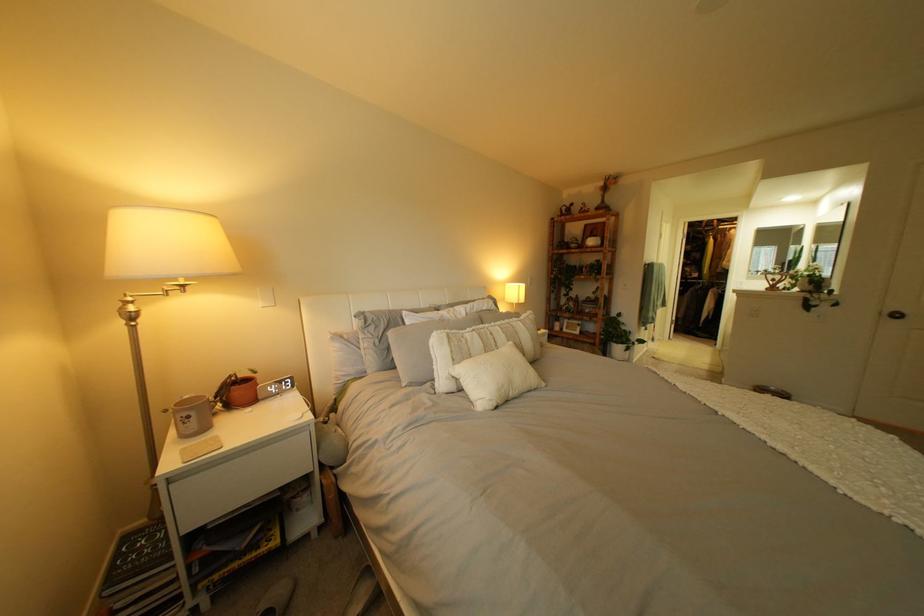
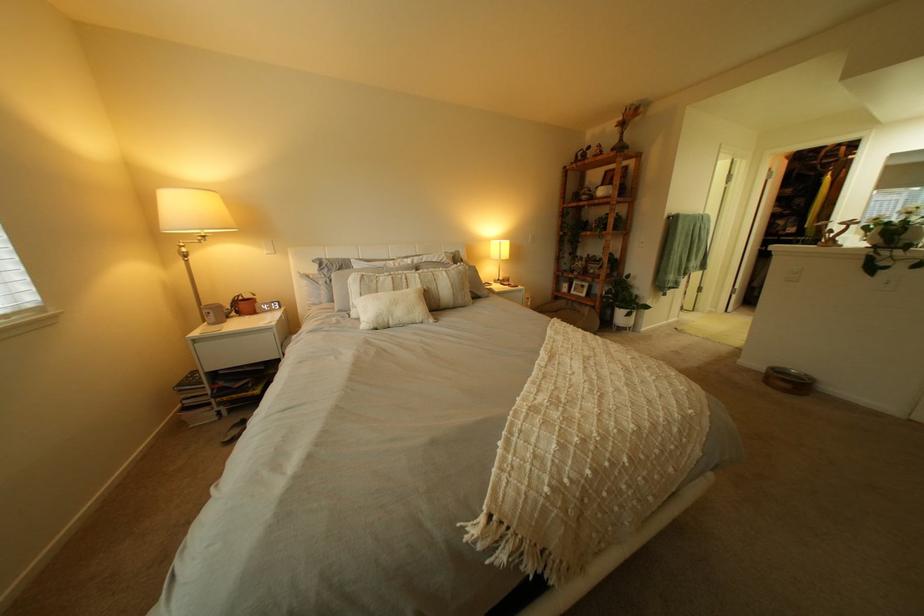
Where in the second image is the point corresponding to the point at 828,469 from the first image?

(541, 387)